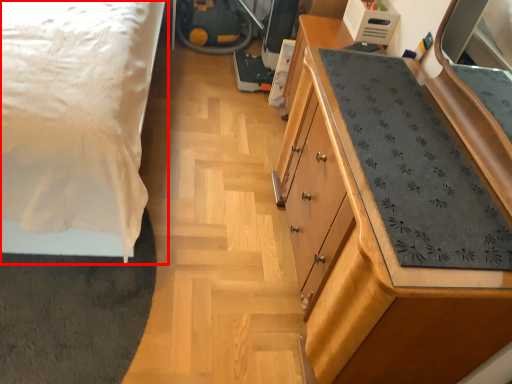
Question: From the image, what is the correct spatial relationship of bed (annotated by the red box) in relation to chest of drawers?

Choices:
 (A) right
 (B) left

Answer: (B)